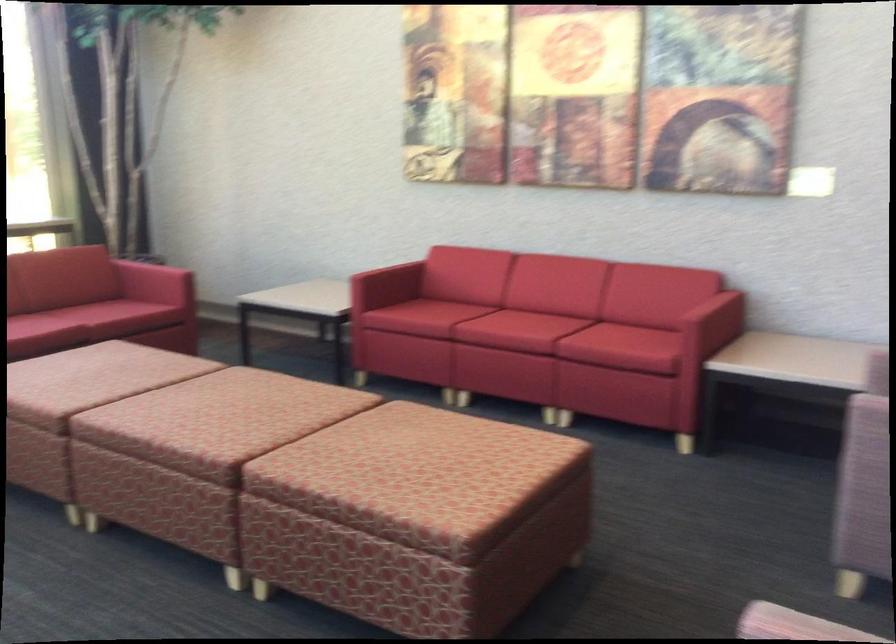
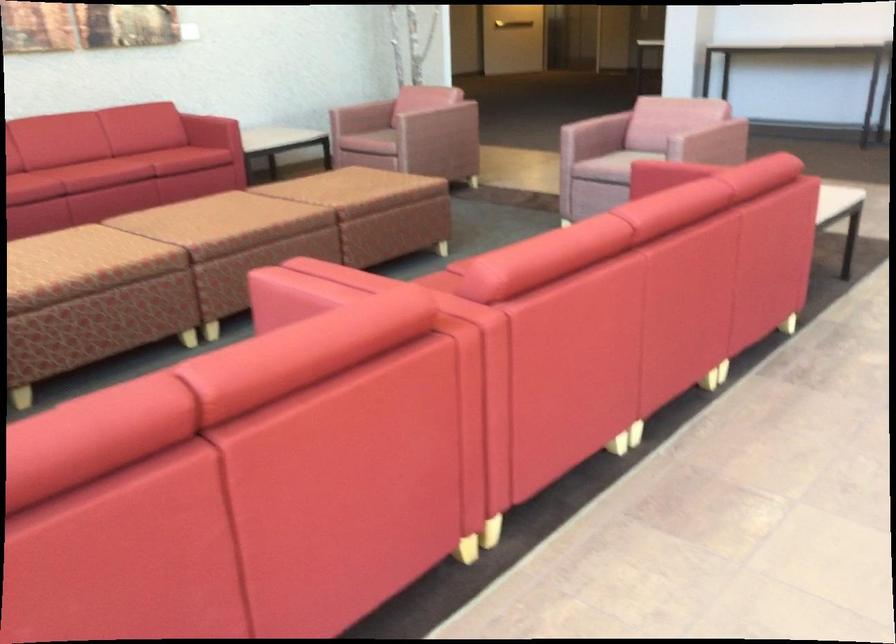
Find the pixel in the second image that matches pixel 245 502 in the first image.

(380, 212)